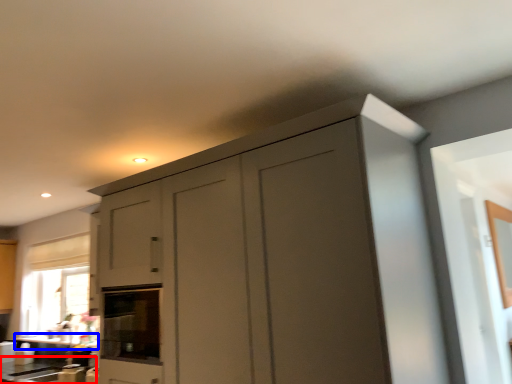
Question: Which object appears closest to the camera in this image, counter top (highlighted by a red box) or counter top (highlighted by a blue box)?

Choices:
 (A) counter top
 (B) counter top

Answer: (A)